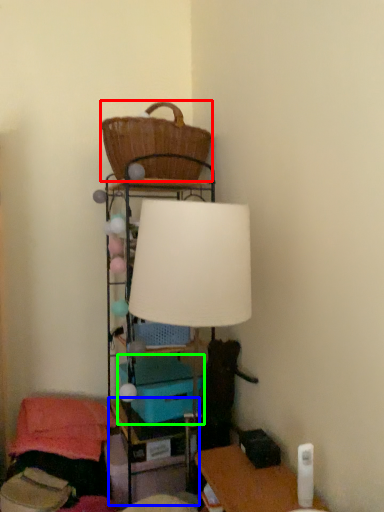
Question: Considering the real-world distances, which object is closest to basket (highlighted by a red box)? table (highlighted by a blue box) or storage box (highlighted by a green box).

Choices:
 (A) table
 (B) storage box

Answer: (B)